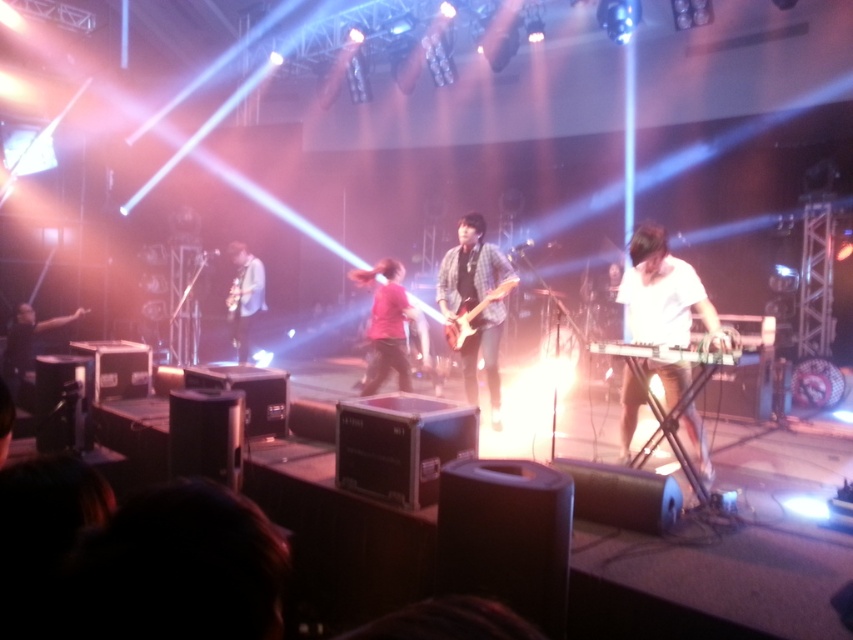
Does white matte keyboardist at right lie behind black drum at left?

No.

Looking at this image, who is more distant from viewer, [682,310] or [22,337]?

Point [22,337]

Identify the location of white matte keyboardist at right. (664, 294).

Who is shorter, black drum at left or shiny black electric guitar at center?

shiny black electric guitar at center

Who is more forward, (15, 355) or (463, 333)?

Positioned in front is point (463, 333).

Locate an element on the screen. This screenshot has width=853, height=640. black drum at left is located at coordinates (27, 340).

Does white matte keyboardist at right have a lesser height compared to plaid shirt guitar at center?

Correct, white matte keyboardist at right is not as tall as plaid shirt guitar at center.

Does white matte keyboardist at right appear on the left side of plaid shirt guitar at center?

No, white matte keyboardist at right is not to the left of plaid shirt guitar at center.

Locate an element on the screen. This screenshot has width=853, height=640. white matte keyboardist at right is located at coordinates (664, 294).